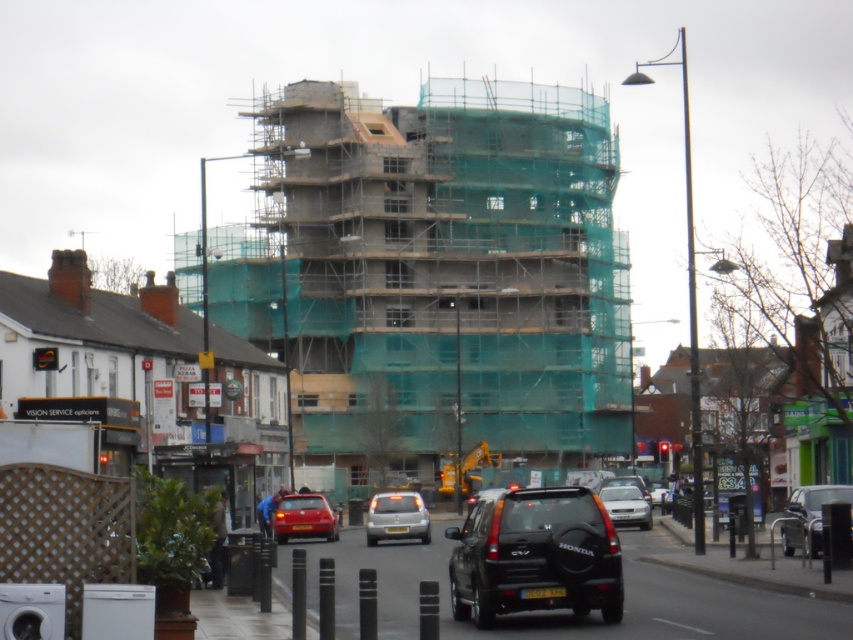
You are a delivery driver who needs to park your vehicle in a space that can accommodate your truck, which is 2 meters wide. You see the matte red car at lower center and the silver metallic sedan at center. Which vehicle has a wider body to determine if the parking space is suitable?

The matte red car at lower center has a larger width than the silver metallic sedan at center. Since your truck is 2 meters wide, you should check if the parking space is wider than the matte red car at lower center to ensure it can accommodate your vehicle.

You are a delivery driver who needs to park your vehicle between the matte red car at lower center and the silver metallic sedan at center. Is there enough space for your van, which is 5 meters long, between them?

The matte red car at lower center is located above the silver metallic sedan at center, so there is no space between them along the road. Your van cannot be parked there.

You are a delivery driver who needs to park your vehicle near the Vision Service store on the left side of the street. The parking spot you want to use is located at point 0.809, 0.358. Is the matte red car at lower center blocking your desired parking spot?

The matte red car at lower center is positioned exactly at point [305,516], so it is blocking the desired parking spot.